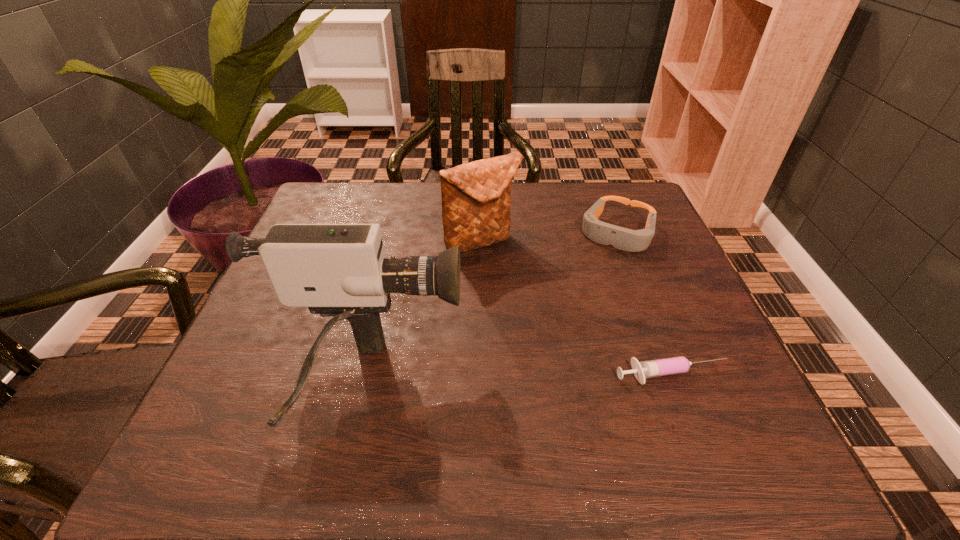
Image resolution: width=960 pixels, height=540 pixels. In order to click on camcorder in this screenshot , I will do `click(336, 270)`.

Locate an element on the screen. the shortest object is located at coordinates (675, 365).

Locate an element on the screen. The height and width of the screenshot is (540, 960). the second tallest object is located at coordinates (476, 196).

The image size is (960, 540). Find the location of `goggles`. goggles is located at coordinates (604, 233).

At what (x,y) coordinates should I click in order to perform the action: click on free location located on the recording direction of the tallest object. Please return your answer as a coordinate pair (x, y). This screenshot has height=540, width=960. Looking at the image, I should click on (646, 381).

Locate an element on the screen. This screenshot has width=960, height=540. vacant point located on the back of the syringe is located at coordinates (622, 244).

This screenshot has height=540, width=960. I want to click on vacant space situated on the open side of the second tallest object, so click(548, 341).

The image size is (960, 540). I want to click on free region located on the open side of the second tallest object, so click(517, 291).

Locate an element on the screen. This screenshot has height=540, width=960. free space located on the open side of the second tallest object is located at coordinates (525, 303).

Locate an element on the screen. This screenshot has width=960, height=540. vacant space located on the front and back of the second shortest object is located at coordinates (586, 300).